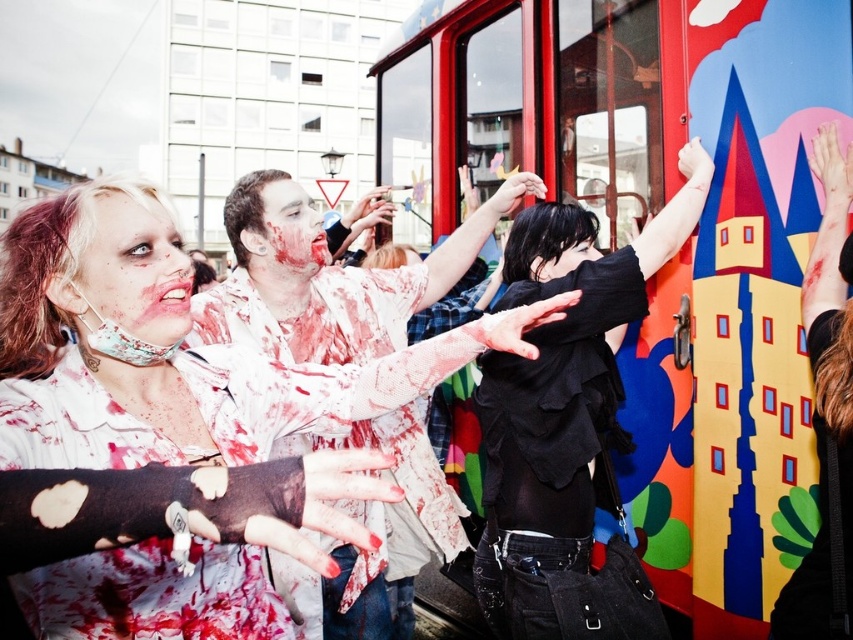
Question: Can you confirm if black leather jacket at upper right is thinner than smooth black hair at center?

Choices:
 (A) yes
 (B) no

Answer: (B)

Question: Which object is farther from the camera taking this photo?

Choices:
 (A) smooth black hair at center
 (B) matte white shirt at center
 (C) black leather jacket at upper right

Answer: (A)

Question: Which object is farther from the camera taking this photo?

Choices:
 (A) matte white shirt at center
 (B) painted wooden door at center
 (C) blood-stained skin at center
 (D) smooth black hair at center

Answer: (C)

Question: Which of the following is the closest to the observer?

Choices:
 (A) (263, 228)
 (B) (126, 195)
 (C) (563, 252)

Answer: (B)

Question: Does black leather jacket at upper right lie in front of blood-stained skin at center?

Choices:
 (A) no
 (B) yes

Answer: (B)

Question: Where is painted wooden door at center located in relation to black leather jacket at upper right in the image?

Choices:
 (A) right
 (B) left

Answer: (B)